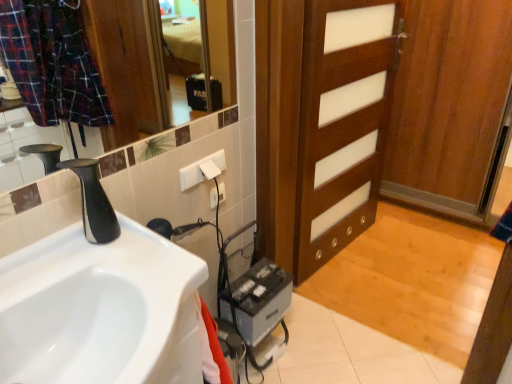
Identify the location of vacant space in front of black matte faucet at left. (86, 276).